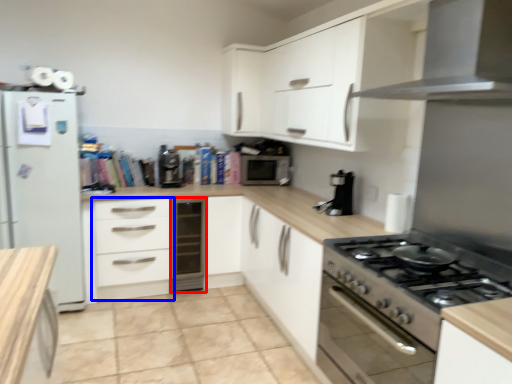
Question: Among these objects, which one is farthest to the camera, dish washer (highlighted by a red box) or drawer (highlighted by a blue box)?

Choices:
 (A) dish washer
 (B) drawer

Answer: (A)